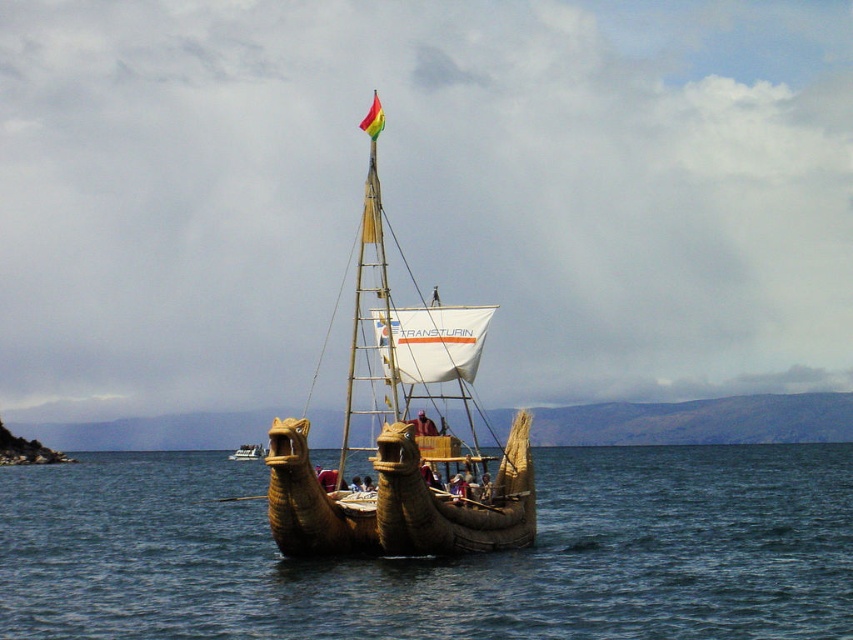
Is brown woven water at center further to camera compared to brown woven reed boat at center?

No, brown woven water at center is in front of brown woven reed boat at center.

Which is in front, point (799, 538) or point (238, 458)?

Point (799, 538) is more forward.

You are a GUI agent. You are given a task and a screenshot of the screen. Output one action in this format:
    pyautogui.click(x=<x>, y=<y>)
    Task: Click on the brown woven water at center
    Image resolution: width=853 pixels, height=640 pixels.
    Given the screenshot: What is the action you would take?
    pyautogui.click(x=436, y=557)

Is point (703, 580) positioned in front of point (334, 528)?

No, it is behind (334, 528).

Between point (711, 454) and point (300, 538), which one is positioned behind?

The point (711, 454) is behind.

Where is `brown woven water at center`? Image resolution: width=853 pixels, height=640 pixels. brown woven water at center is located at coordinates (436, 557).

Does natural wood boat at center have a greater width compared to rainbow fabric flag at top center?

Yes.

Between natural wood boat at center and rainbow fabric flag at top center, which one has less height?

With less height is natural wood boat at center.

Find the location of `natural wood boat at center`. natural wood boat at center is located at coordinates (403, 435).